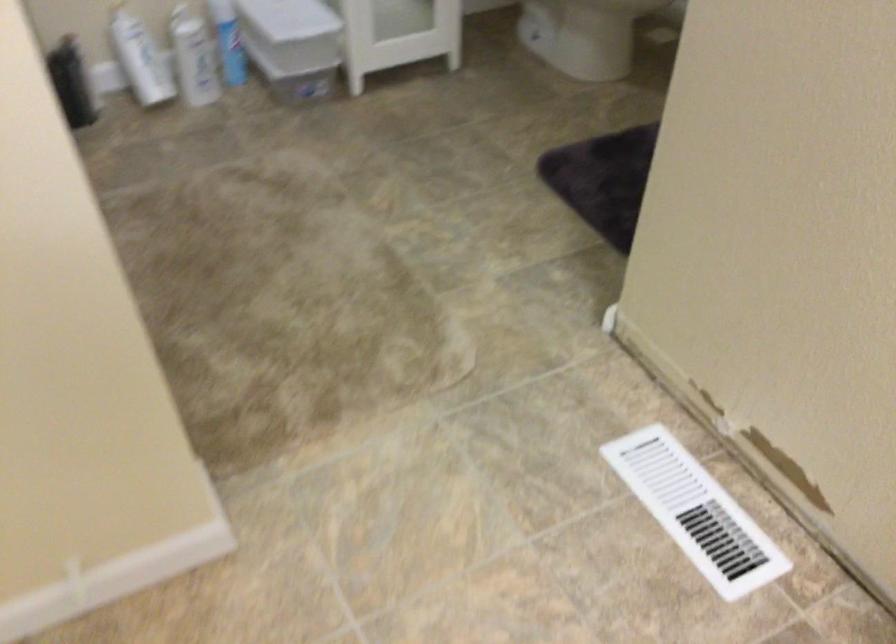
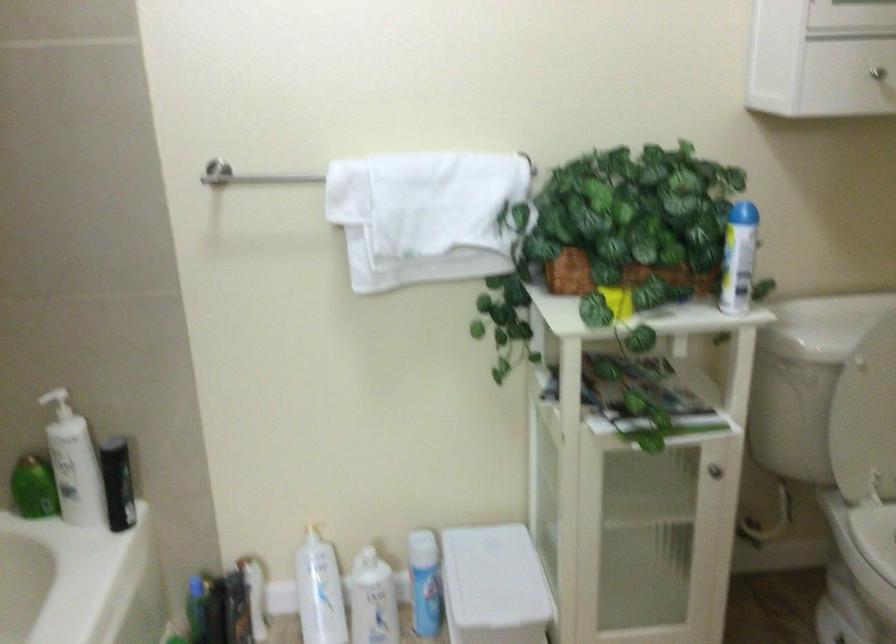
The images are taken continuously from a first-person perspective. In which direction is your viewpoint rotating?

The rotation direction of the camera is left-up.